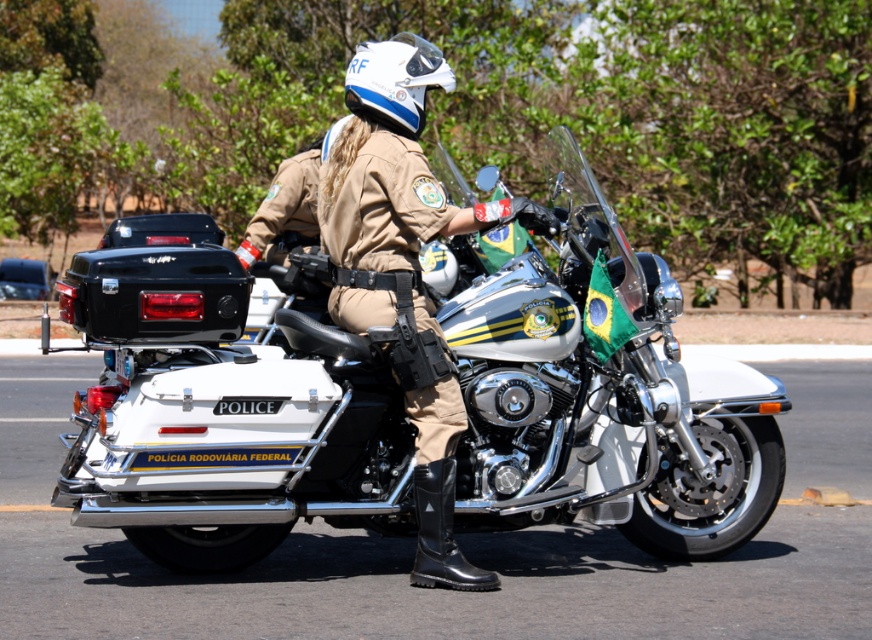
Question: Which of these objects is positioned closest to the brown leather jacket at center?

Choices:
 (A) white matte helmet at upper center
 (B) white metallic motorcycle at center

Answer: (B)

Question: Can you confirm if white metallic motorcycle at center is positioned to the left of white matte helmet at upper center?

Choices:
 (A) no
 (B) yes

Answer: (A)

Question: Which object is the farthest from the white metallic motorcycle at center?

Choices:
 (A) brown leather jacket at center
 (B) white matte helmet at upper center

Answer: (B)

Question: Can you confirm if white metallic motorcycle at center is thinner than brown leather jacket at center?

Choices:
 (A) yes
 (B) no

Answer: (B)

Question: Which of these objects is positioned farthest from the brown leather jacket at center?

Choices:
 (A) white matte helmet at upper center
 (B) white metallic motorcycle at center

Answer: (A)

Question: Does brown leather jacket at center appear over white matte helmet at upper center?

Choices:
 (A) no
 (B) yes

Answer: (A)